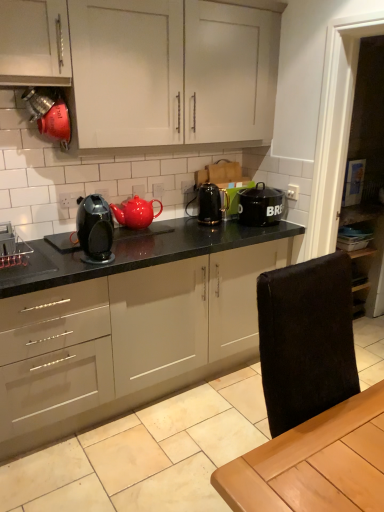
Question: Considering the relative sizes of black granite countertop at center and black glossy electric kettle at center, which is the second appliance in front-to-back order, in the image provided, is black granite countertop at center smaller than black glossy electric kettle at center, which is the second appliance in front-to-back order,?

Choices:
 (A) yes
 (B) no

Answer: (B)

Question: Is black granite countertop at center positioned far away from black glossy electric kettle at center, marked as the first appliance in a back-to-front arrangement?

Choices:
 (A) yes
 (B) no

Answer: (B)

Question: From the image's perspective, is black granite countertop at center over black glossy electric kettle at center, the first appliance viewed from the right?

Choices:
 (A) yes
 (B) no

Answer: (B)

Question: Is black glossy electric kettle at center, which is the second appliance from left to right, surrounded by black granite countertop at center?

Choices:
 (A) no
 (B) yes

Answer: (A)

Question: Can you confirm if black granite countertop at center is shorter than black glossy electric kettle at center, marked as the first appliance in a back-to-front arrangement?

Choices:
 (A) yes
 (B) no

Answer: (B)

Question: Is black granite countertop at center facing away from black glossy electric kettle at center, which is the second appliance from left to right?

Choices:
 (A) no
 (B) yes

Answer: (A)

Question: Is matte black coffee maker at center shorter than black glossy electric kettle at center, which is the second appliance from left to right?

Choices:
 (A) no
 (B) yes

Answer: (A)

Question: Are matte black coffee maker at center and black glossy electric kettle at center, which is the second appliance from left to right, far apart?

Choices:
 (A) no
 (B) yes

Answer: (A)

Question: Is matte black coffee maker at center closer to the viewer compared to black glossy electric kettle at center, arranged as the first appliance when viewed from the top?

Choices:
 (A) yes
 (B) no

Answer: (A)

Question: Is the depth of matte black coffee maker at center greater than that of black glossy electric kettle at center, the 2th appliance when ordered from bottom to top?

Choices:
 (A) no
 (B) yes

Answer: (A)

Question: Is matte black coffee maker at center positioned with its back to black glossy electric kettle at center, the first appliance viewed from the right?

Choices:
 (A) no
 (B) yes

Answer: (A)

Question: From the image's perspective, would you say matte black coffee maker at center is positioned over black glossy electric kettle at center, marked as the first appliance in a back-to-front arrangement?

Choices:
 (A) yes
 (B) no

Answer: (B)

Question: Can you confirm if matte black coffee maker at center is thinner than brushed metal spice rack at left, the second appliance from the top?

Choices:
 (A) no
 (B) yes

Answer: (B)